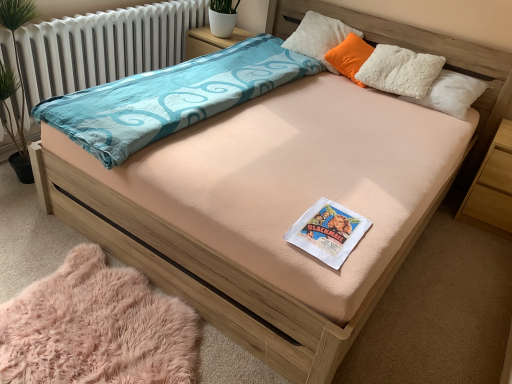
Question: From a real-world perspective, is light brown wood at right physically above orange soft pillow at upper right, which appears as the first pillow when ordered from the bottom?

Choices:
 (A) no
 (B) yes

Answer: (A)

Question: Can you confirm if light brown wood at right is taller than orange soft pillow at upper right, the 2th pillow from the top?

Choices:
 (A) yes
 (B) no

Answer: (A)

Question: Considering the relative sizes of light brown wood at right and orange soft pillow at upper right, which appears as the first pillow when ordered from the bottom, in the image provided, is light brown wood at right wider than orange soft pillow at upper right, which appears as the first pillow when ordered from the bottom,?

Choices:
 (A) no
 (B) yes

Answer: (B)

Question: Would you say light brown wood at right contains orange soft pillow at upper right, the 2th pillow from the top?

Choices:
 (A) no
 (B) yes

Answer: (A)

Question: Can you confirm if light brown wood at right is shorter than orange soft pillow at upper right, the 2th pillow from the top?

Choices:
 (A) no
 (B) yes

Answer: (A)

Question: Is light brown wood at right not close to orange soft pillow at upper right, the 2th pillow from the top?

Choices:
 (A) yes
 (B) no

Answer: (B)

Question: Does pink fluffy rug at lower left have a lesser height compared to white paper book at center?

Choices:
 (A) no
 (B) yes

Answer: (B)

Question: Does pink fluffy rug at lower left touch white paper book at center?

Choices:
 (A) no
 (B) yes

Answer: (A)

Question: Is pink fluffy rug at lower left facing away from white paper book at center?

Choices:
 (A) yes
 (B) no

Answer: (B)

Question: Does pink fluffy rug at lower left have a larger size compared to white paper book at center?

Choices:
 (A) no
 (B) yes

Answer: (B)

Question: Is pink fluffy rug at lower left at the right side of white paper book at center?

Choices:
 (A) no
 (B) yes

Answer: (A)

Question: Is pink fluffy rug at lower left surrounding white paper book at center?

Choices:
 (A) no
 (B) yes

Answer: (A)

Question: Is pink fluffy rug at lower left at the back of white paper book at center?

Choices:
 (A) yes
 (B) no

Answer: (B)